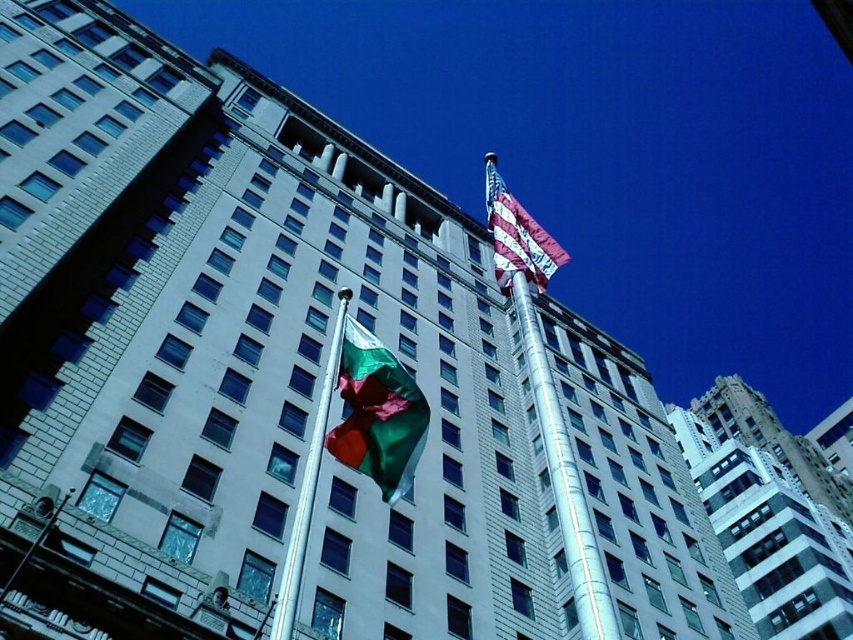
This screenshot has height=640, width=853. Identify the location of green fabric flag at center. (376, 413).

Is green fabric flag at center above american flag at upper right?

Actually, green fabric flag at center is below american flag at upper right.

This screenshot has height=640, width=853. I want to click on green fabric flag at center, so click(x=376, y=413).

Is silver metallic mast at center above american flag at upper right?

No.

The width and height of the screenshot is (853, 640). I want to click on silver metallic mast at center, so click(564, 481).

Measure the distance between silver metallic mast at center and camera.

21.17 meters

Is silver metallic mast at center positioned before silver metallic pole at center?

No, silver metallic mast at center is behind silver metallic pole at center.

Who is more distant from viewer, (583,632) or (299,568)?

Point (583,632)

At what (x,y) coordinates should I click in order to perform the action: click on silver metallic mast at center. Please return your answer as a coordinate pair (x, y). Looking at the image, I should click on (564, 481).